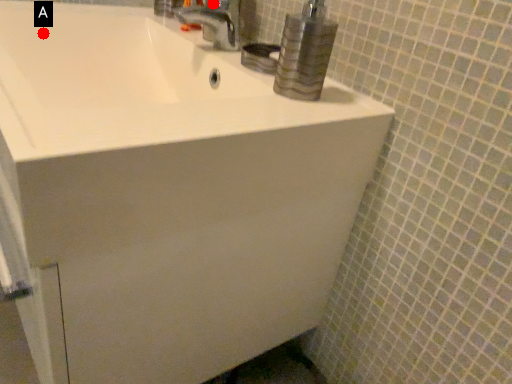
Question: Two points are circled on the image, labeled by A and B beside each circle. Which point is further to the camera?

Choices:
 (A) A is further
 (B) B is further

Answer: (B)